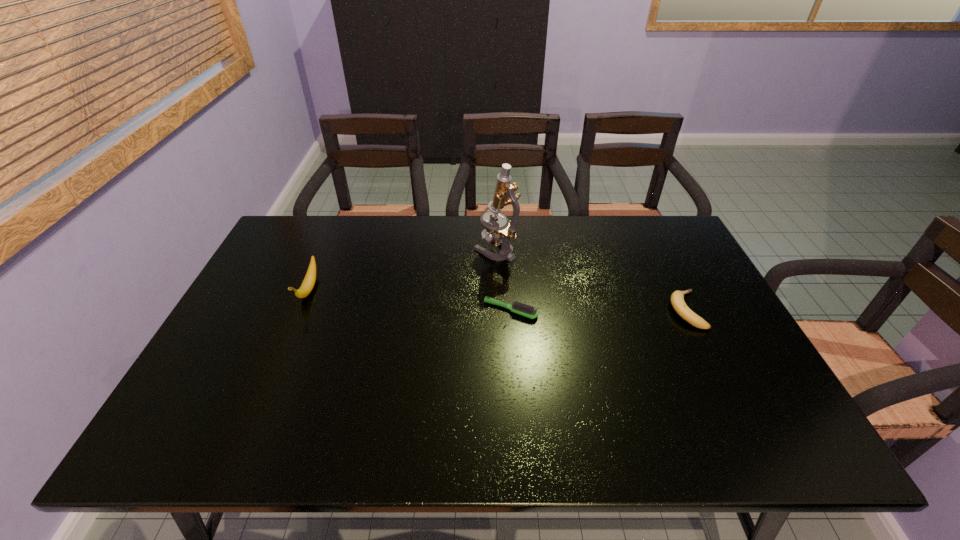
You are a GUI agent. You are given a task and a screenshot of the screen. Output one action in this format:
    pyautogui.click(x=<x>, y=<y>)
    Task: Click on the vacant area that satisfies the following two spatial constraints: 1. at the stem of the rightmost object; 2. on the right side of the second tallest object
    
    Given the screenshot: What is the action you would take?
    pyautogui.click(x=300, y=310)